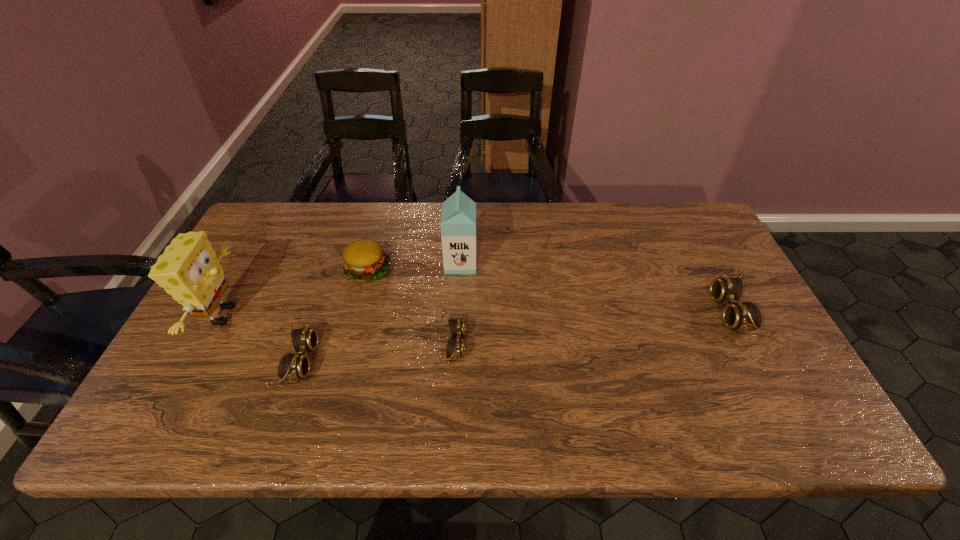
Image resolution: width=960 pixels, height=540 pixels. I want to click on the second tallest goggles, so click(292, 366).

The image size is (960, 540). I want to click on the fifth object from right to left, so click(x=292, y=366).

At what (x,y) coordinates should I click in order to perform the action: click on the shortest goggles. Please return your answer as a coordinate pair (x, y). The height and width of the screenshot is (540, 960). Looking at the image, I should click on (455, 348).

Identify the location of the shortest object. (455, 348).

The width and height of the screenshot is (960, 540). In order to click on the tallest goggles in this screenshot , I will do `click(746, 316)`.

Locate an element on the screen. The height and width of the screenshot is (540, 960). the rightmost goggles is located at coordinates click(746, 316).

Where is `milk carton`? The width and height of the screenshot is (960, 540). milk carton is located at coordinates (458, 218).

Where is `the third object from left to right`? The width and height of the screenshot is (960, 540). the third object from left to right is located at coordinates (365, 260).

The height and width of the screenshot is (540, 960). I want to click on the leftmost object, so click(x=188, y=270).

This screenshot has height=540, width=960. Find the location of `free region located through the lenses of the second tallest goggles`. free region located through the lenses of the second tallest goggles is located at coordinates (385, 361).